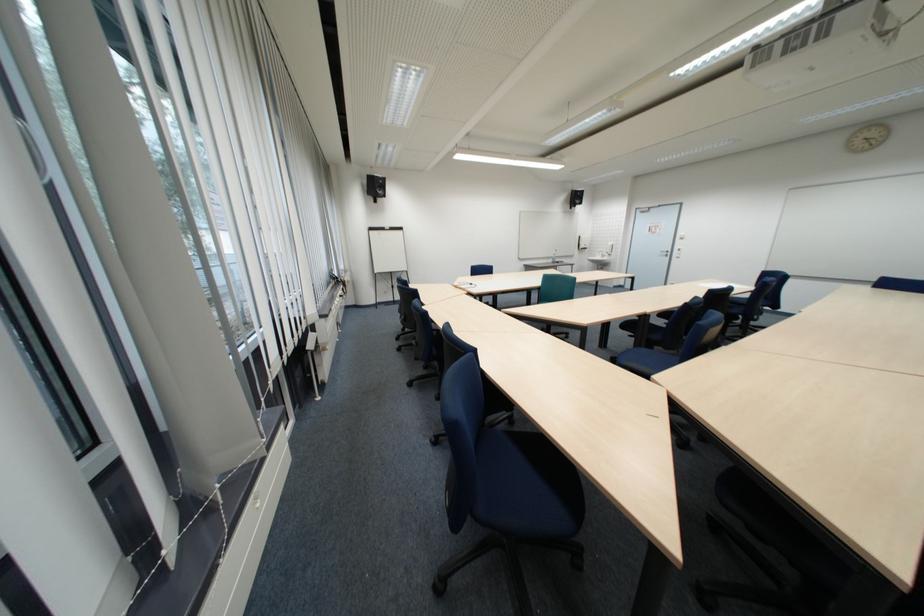
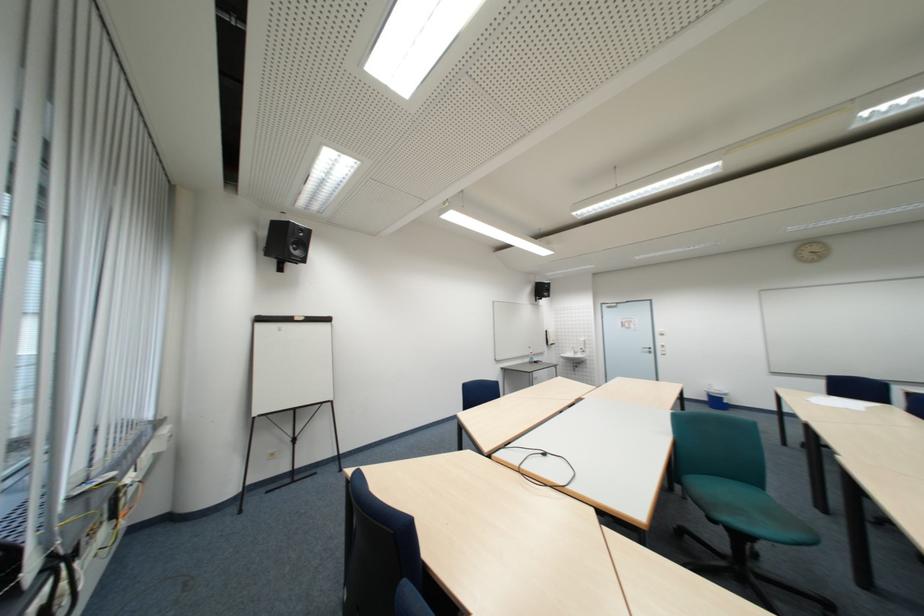
Find the pixel in the second image that matches (383,230) in the first image.

(273, 321)